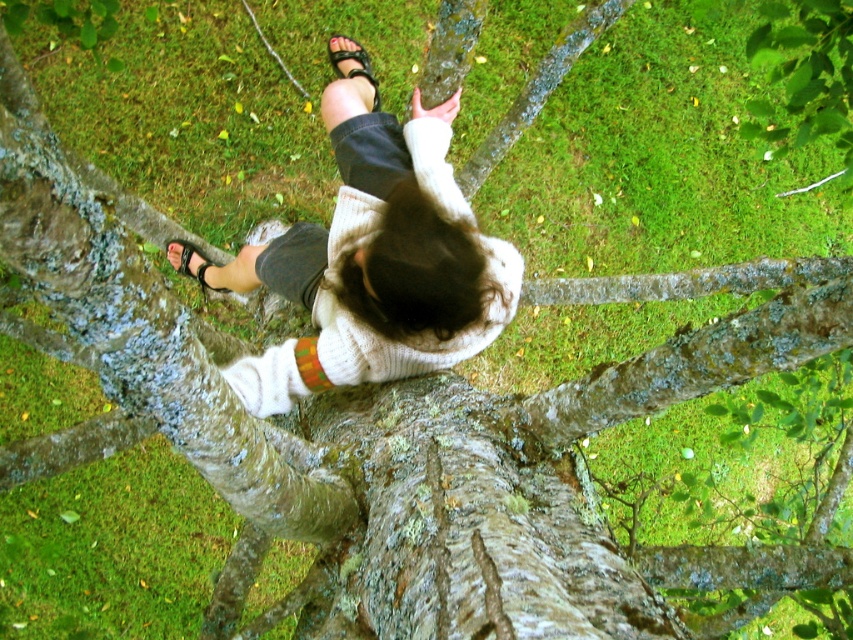
Can you confirm if white knitted sweater at center is positioned to the left of black leather sandal at lower left?

Incorrect, white knitted sweater at center is not on the left side of black leather sandal at lower left.

Is point (384, 380) more distant than point (222, 288)?

No, it is not.

This screenshot has height=640, width=853. I want to click on white knitted sweater at center, so click(376, 262).

Does black leather sandal at center have a greater width compared to black leather sandal at lower left?

In fact, black leather sandal at center might be narrower than black leather sandal at lower left.

Consider the image. Is black leather sandal at center positioned behind black leather sandal at lower left?

No.

Image resolution: width=853 pixels, height=640 pixels. What do you see at coordinates (354, 67) in the screenshot?
I see `black leather sandal at center` at bounding box center [354, 67].

Locate an element on the screen. This screenshot has height=640, width=853. black leather sandal at center is located at coordinates (354, 67).

Measure the distance between white knitted sweater at center and black leather sandal at center.

white knitted sweater at center is 23.77 inches away from black leather sandal at center.

Is point (474, 349) closer to viewer compared to point (364, 51)?

Yes, it is in front of point (364, 51).

Is point (489, 285) less distant than point (357, 67)?

Yes, point (489, 285) is in front of point (357, 67).

In order to click on white knitted sweater at center in this screenshot , I will do `click(376, 262)`.